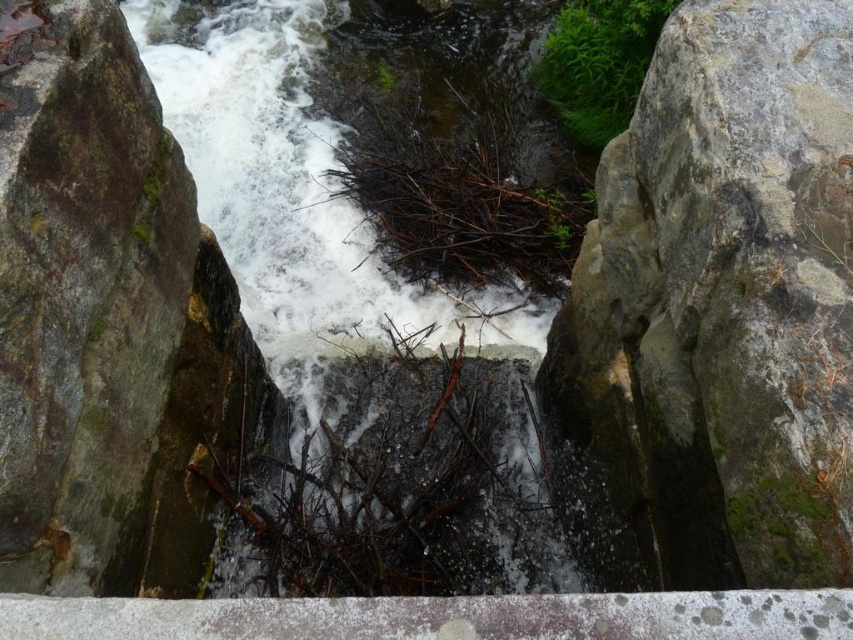
You are a hiker who wants to cross the waterfall by stepping on the gray rough rock at center and the brown woody twig at center. Which object can you safely step on without slipping?

The gray rough rock at center has a greater height compared to the brown woody twig at center, so stepping on the gray rough rock at center is safer as it provides a more stable and elevated surface.

You are standing at the edge of the waterfall and want to cross to the other side. There is a green mossy rock at left and a white frothy water at center in your path. Which object should you avoid stepping on to safely cross?

You should avoid stepping on the white frothy water at center because it is the flowing water where the waterfall hits the rocks, making it unsafe. The green mossy rock at left is a solid surface and can be used for crossing safely.

Based on the scene description, where is the green mossy rock located relative to the point marked at coordinates [109,326]?

The point at coordinates [109,326] marks the location of the green mossy rock at left.